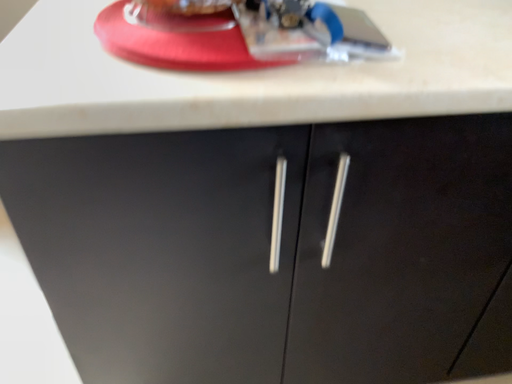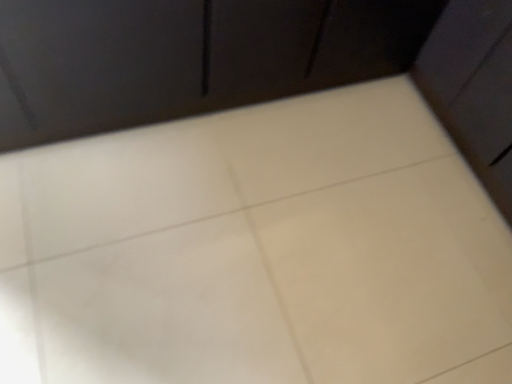
Question: How did the camera likely rotate when shooting the video?

Choices:
 (A) rotated upward
 (B) rotated downward

Answer: (B)